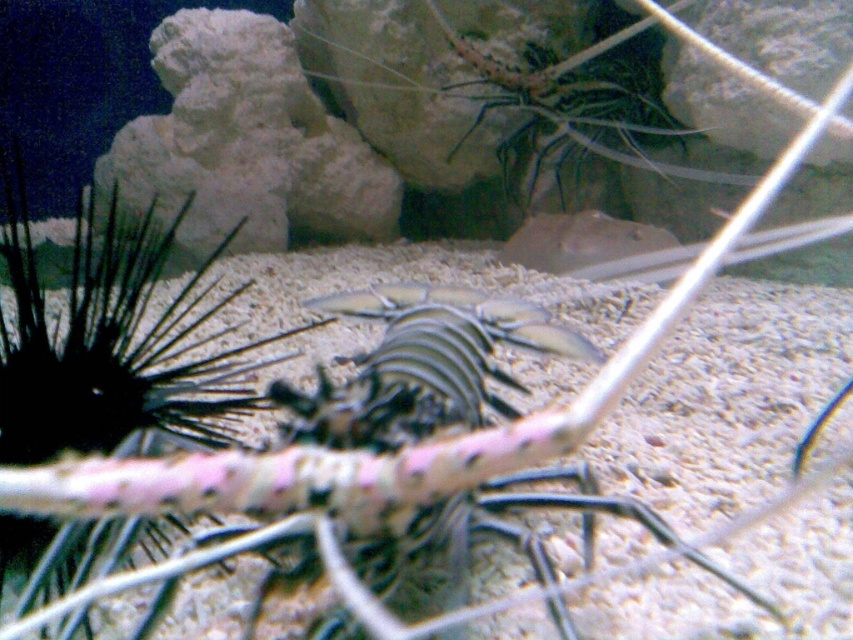
Who is shorter, shiny black lobster at center or translucent glass shrimp at upper center?

shiny black lobster at center

Is point (521, 467) behind point (358, 88)?

No.

Identify the location of shiny black lobster at center. The height and width of the screenshot is (640, 853). (380, 476).